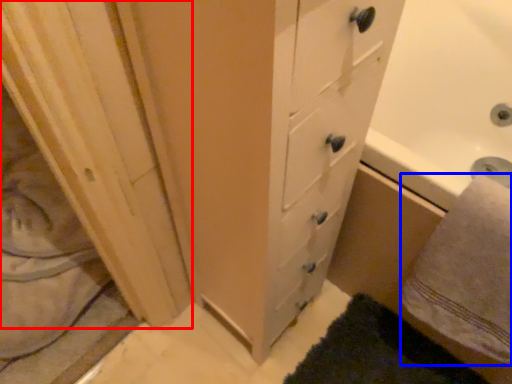
Question: Which of the following is the farthest to the observer, screen door (highlighted by a red box) or bath towel (highlighted by a blue box)?

Choices:
 (A) screen door
 (B) bath towel

Answer: (A)